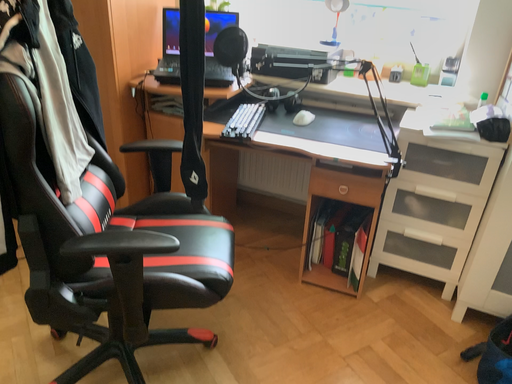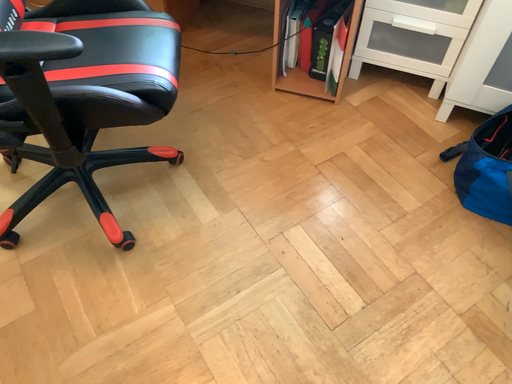
Question: Which way did the camera rotate in the video?

Choices:
 (A) rotated downward
 (B) rotated upward

Answer: (A)